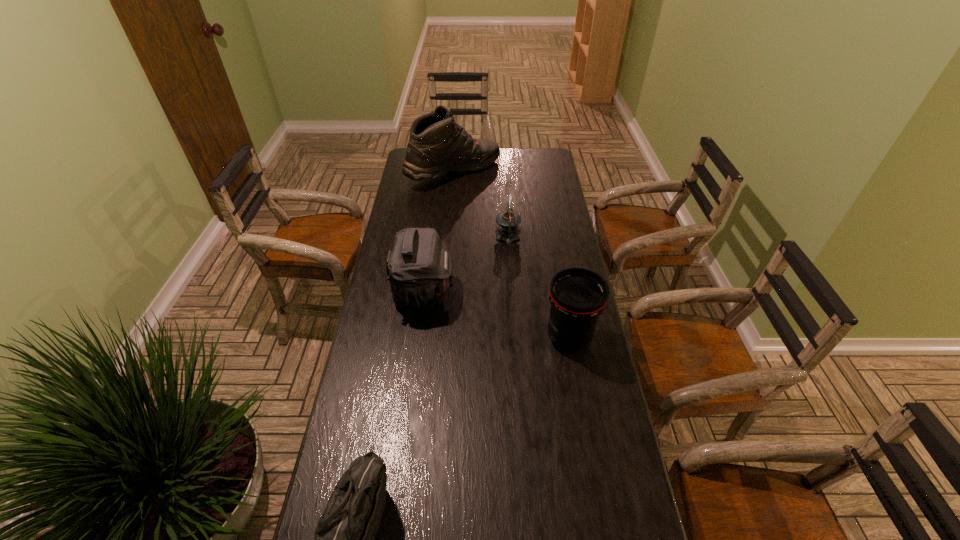
Find the location of a particular element. Image resolution: width=960 pixels, height=540 pixels. the farthest object is located at coordinates (437, 145).

Identify the location of oil lamp. (508, 220).

This screenshot has height=540, width=960. What are the coordinates of `the taller shoulder bag` in the screenshot? It's located at (419, 269).

I want to click on telephoto lens, so click(578, 296).

Find the location of a particular element. The height and width of the screenshot is (540, 960). vacant area located 0.050m on the front of the farthest object is located at coordinates (451, 200).

This screenshot has width=960, height=540. I want to click on vacant space situated on the right of the oil lamp, so click(x=569, y=238).

Locate an element on the screen. free space located on the open flap of the taller shoulder bag is located at coordinates 514,293.

This screenshot has height=540, width=960. In order to click on free space located 0.120m on the left of the telephoto lens in this screenshot , I will do (506, 339).

Image resolution: width=960 pixels, height=540 pixels. I want to click on object located at the far edge, so click(437, 145).

The height and width of the screenshot is (540, 960). I want to click on ski boot that is at the left edge, so click(437, 145).